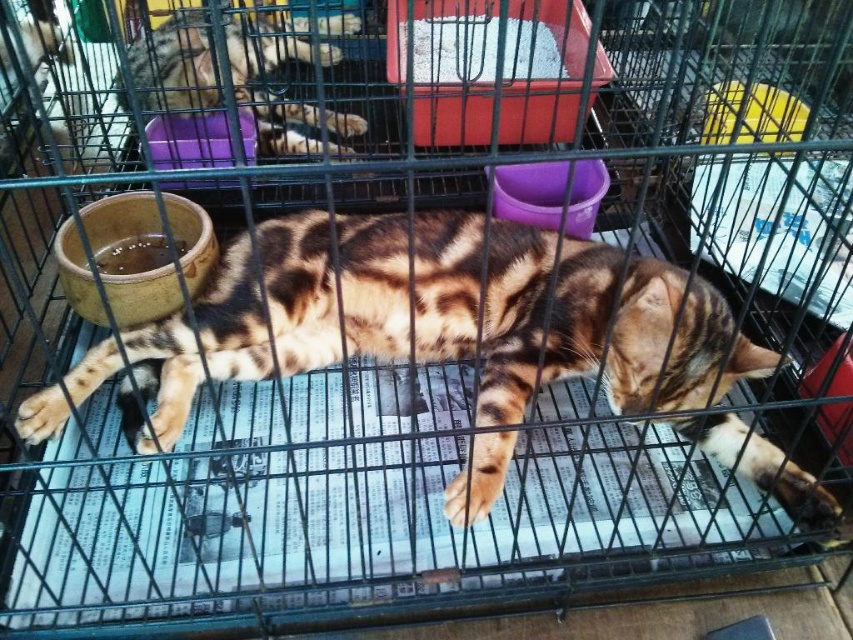
Question: Which point is farther to the camera?

Choices:
 (A) tabby fur cat at center
 (B) tabby fur cat at upper left

Answer: (B)

Question: Does tabby fur cat at center appear on the right side of tabby fur cat at upper left?

Choices:
 (A) yes
 (B) no

Answer: (A)

Question: Is tabby fur cat at center behind tabby fur cat at upper left?

Choices:
 (A) no
 (B) yes

Answer: (A)

Question: Can you confirm if tabby fur cat at center is positioned above tabby fur cat at upper left?

Choices:
 (A) yes
 (B) no

Answer: (B)

Question: Which point is farther to the camera?

Choices:
 (A) (135, 344)
 (B) (299, 42)

Answer: (B)